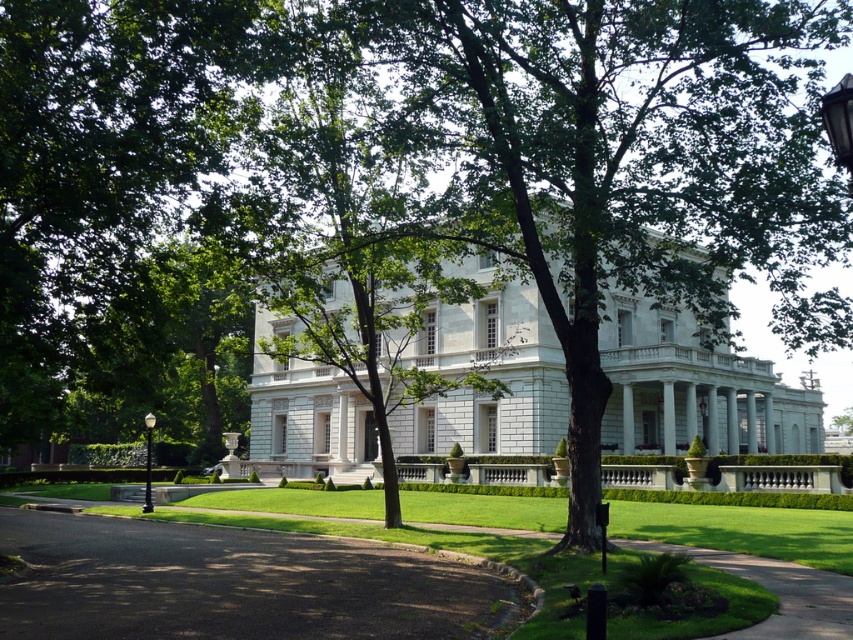
Who is positioned more to the left, white stone mansion at center or black polished metal lamp post at left?

black polished metal lamp post at left is more to the left.

Which is more to the right, white stone mansion at center or black polished metal lamp post at left?

white stone mansion at center

Which is behind, point (817, 401) or point (149, 477)?

The point (817, 401) is behind.

Image resolution: width=853 pixels, height=640 pixels. Find the location of `white stone mansion at center`. white stone mansion at center is located at coordinates (694, 392).

Does dark asphalt driveway at lower left have a lesser height compared to black glass lamp post at upper right?

No, dark asphalt driveway at lower left is not shorter than black glass lamp post at upper right.

Between dark asphalt driveway at lower left and black glass lamp post at upper right, which one has more height?

dark asphalt driveway at lower left

Between point (254, 538) and point (834, 116), which one is positioned behind?

Point (254, 538)

The image size is (853, 640). Identify the location of dark asphalt driveway at lower left. (233, 584).

From the picture: Which of these two, dark asphalt driveway at lower left or black polished metal lamp post at left, stands shorter?

Standing shorter between the two is dark asphalt driveway at lower left.

Where is `dark asphalt driveway at lower left`? Image resolution: width=853 pixels, height=640 pixels. dark asphalt driveway at lower left is located at coordinates (233, 584).

Locate an element on the screen. The image size is (853, 640). dark asphalt driveway at lower left is located at coordinates (233, 584).